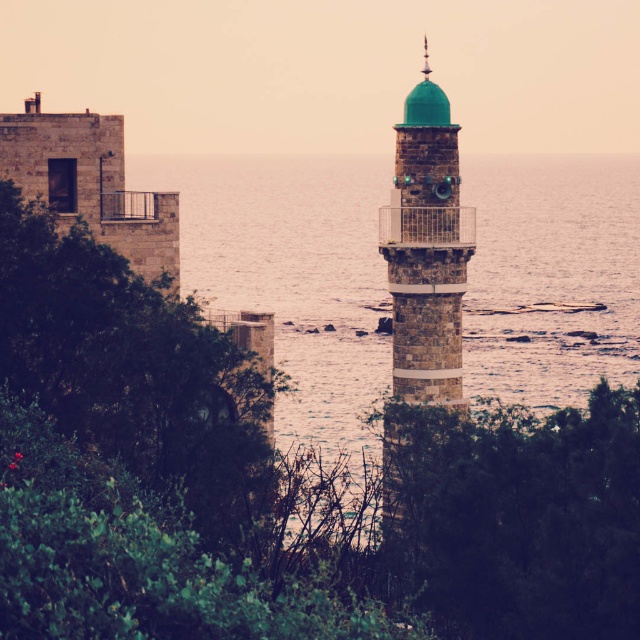
Question: Which point appears farthest from the camera in this image?

Choices:
 (A) (8, 326)
 (B) (499, 179)
 (C) (432, 113)

Answer: (B)

Question: Can you confirm if green leafy bush at center is positioned above green leafy tree at left?

Choices:
 (A) no
 (B) yes

Answer: (A)

Question: Is green leafy bush at center thinner than green leafy tree at left?

Choices:
 (A) yes
 (B) no

Answer: (A)

Question: Among these points, which one is nearest to the camera?

Choices:
 (A) (554, 332)
 (B) (445, 156)

Answer: (B)

Question: Can you confirm if smooth stone water at center is thinner than green leafy bush at center?

Choices:
 (A) no
 (B) yes

Answer: (A)

Question: Based on their relative distances, which object is farther from the smooth stone water at center?

Choices:
 (A) green stone minaret at center
 (B) green leafy tree at left

Answer: (A)